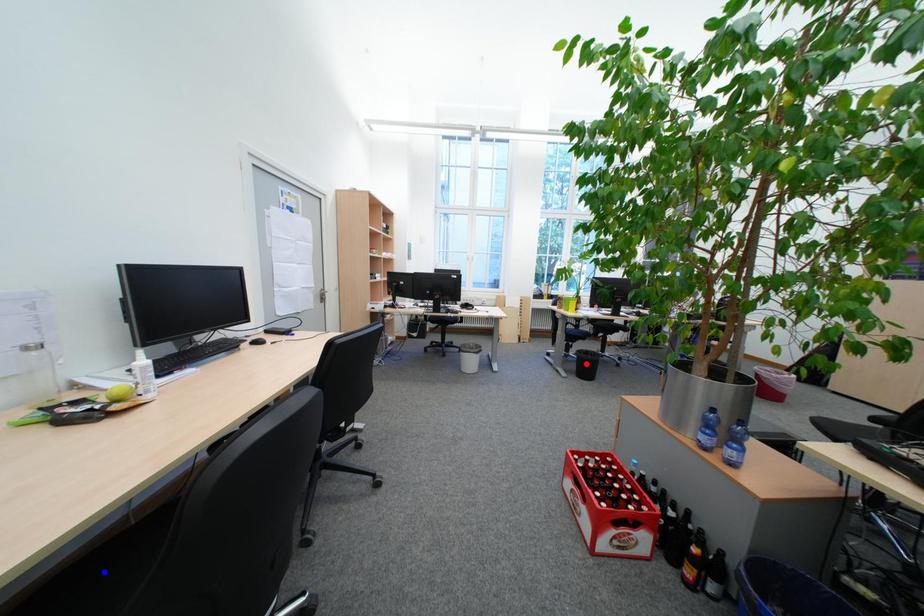
Question: In the image, two points are highlighted. Which point is nearer to the camera? Reply with the corresponding letter.

Choices:
 (A) blue point
 (B) red point

Answer: (A)